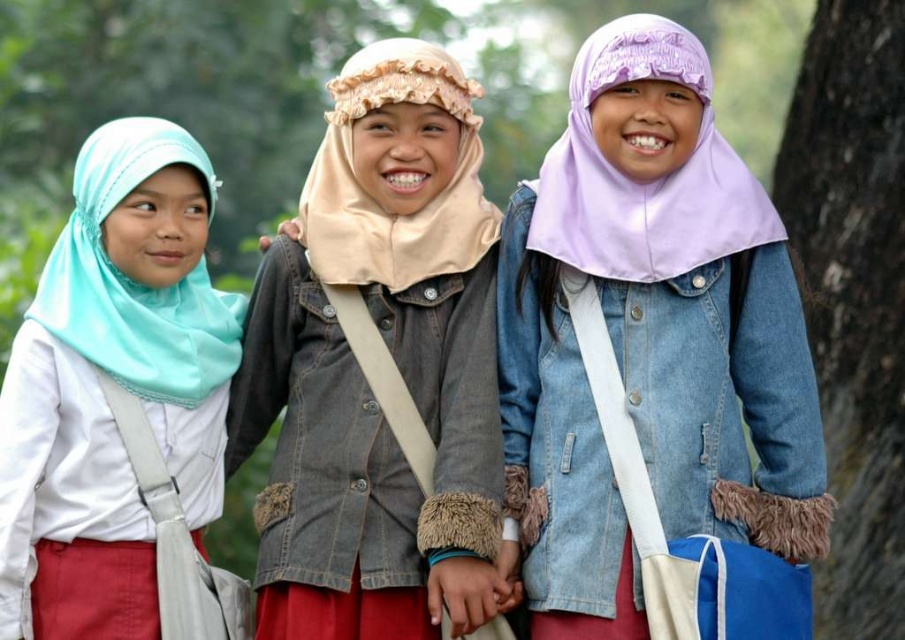
Question: Which of these objects is positioned farthest from the matte light blue hijab at left?

Choices:
 (A) smooth bark tree at right
 (B) purple matte hijab at center

Answer: (A)

Question: Can you confirm if purple matte hijab at center is positioned to the left of smooth bark tree at right?

Choices:
 (A) yes
 (B) no

Answer: (A)

Question: Does denim jacket at center appear over matte light blue hijab at left?

Choices:
 (A) no
 (B) yes

Answer: (B)

Question: Considering the real-world distances, which object is closest to the purple matte hijab at center?

Choices:
 (A) matte light blue hijab at left
 (B) denim jacket at center

Answer: (B)

Question: Which object appears closest to the camera in this image?

Choices:
 (A) matte light blue hijab at left
 (B) purple matte hijab at center
 (C) denim jacket at center

Answer: (B)

Question: Does purple matte hijab at center appear under smooth bark tree at right?

Choices:
 (A) yes
 (B) no

Answer: (A)